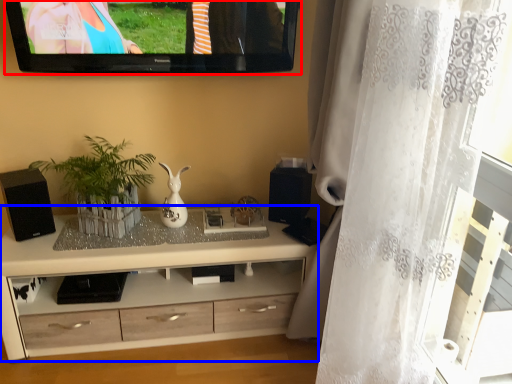
Question: Among these objects, which one is farthest to the camera, television (highlighted by a red box) or cabinetry (highlighted by a blue box)?

Choices:
 (A) television
 (B) cabinetry

Answer: (B)